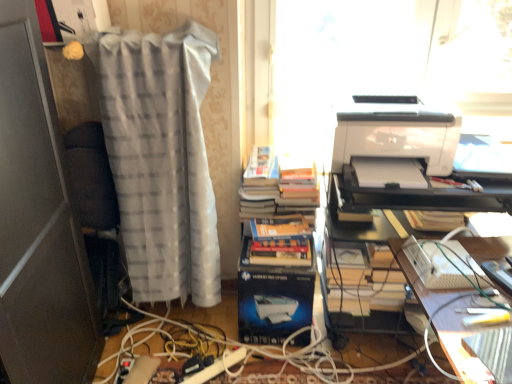
Locate an element on the screen. The height and width of the screenshot is (384, 512). spots to the right of white plastic keyboard at lower right, which ranks as the 2th equipment in right-to-left order is located at coordinates (485, 252).